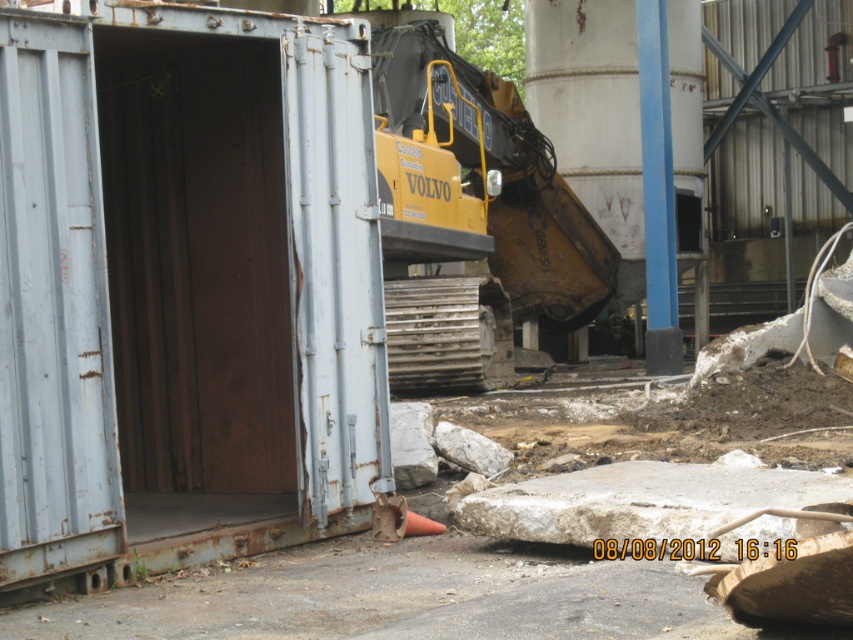
You are a delivery driver who needs to park your truck, which is 15 feet long, near the rusty metal shipping container at left and the yellow metallic excavator at center. Based on their sizes, can you safely park your truck between them without touching either?

The rusty metal shipping container at left is larger than the yellow metallic excavator at center, so there might be sufficient space between them to park your truck. However, since the exact distance isn

You are a construction worker who needs to move a heavy object from the rusty metal shipping container at left to the yellow metallic excavator at center. The object weighs 5 tons and requires a crane with a minimum reach of 5 meters. Do you think the excavator can handle this task based on the distance shown in the image?

The distance between the rusty metal shipping container at left and the yellow metallic excavator at center is 4.98 meters. Since the excavator requires a minimum reach of 5 meters to lift the 5 ton object, the excavator cannot safely perform this task as the distance is slightly less than required.

You are a construction worker who needs to move a heavy object from the rusty metal shipping container at left to the yellow metallic excavator at center. Based on their positions, which direction should you move the object to reach the excavator?

The rusty metal shipping container at left is to the left of the yellow metallic excavator at center, so you should move the object to the right to reach the excavator.